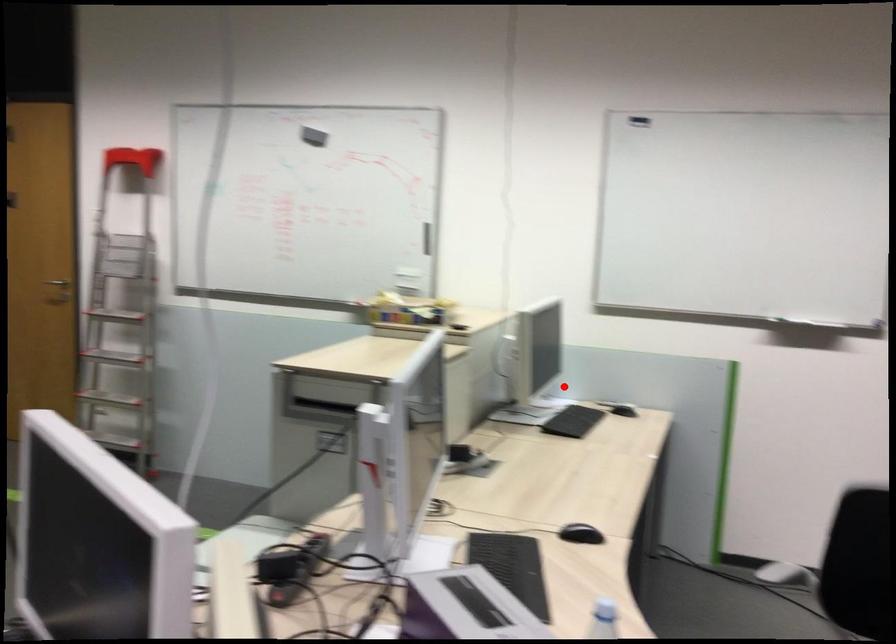
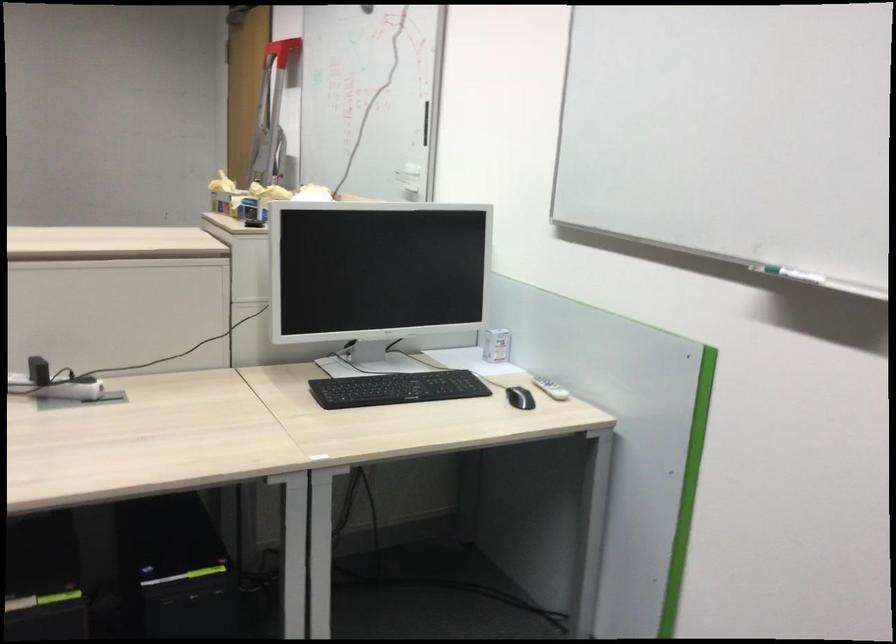
The point at the highlighted location is marked in the first image. Where is the corresponding point in the second image?

(495, 345)